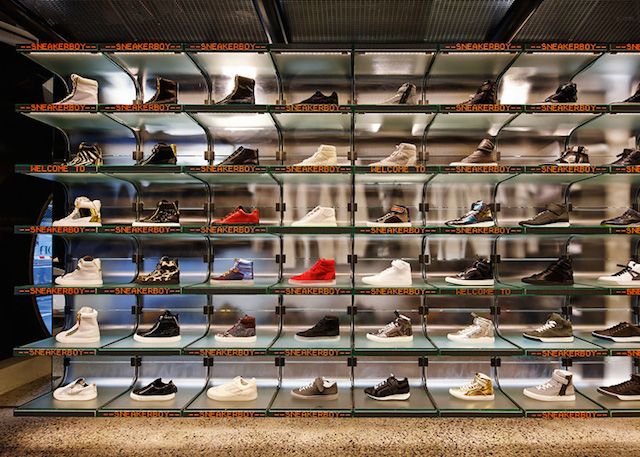
What are the coordinates of `floor in front of sneaker shelving` in the screenshot? It's located at (605, 436), (362, 437), (122, 438), (12, 436).